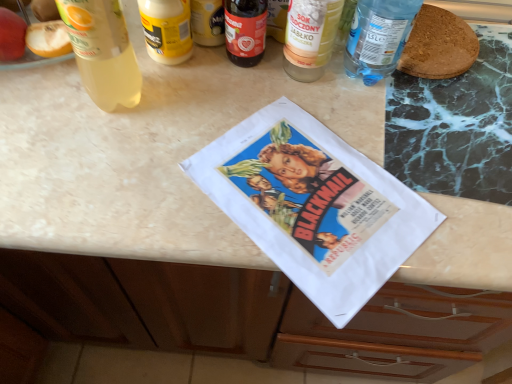
How much space does translucent plastic bottle at upper left, which is counted as the fifth bottle, starting from the right, occupy horizontally?

It is 4.09 inches.

Find the location of a particular element. transparent plastic bottle at upper right, the 1th bottle in the right-to-left sequence is located at coordinates (378, 37).

Between translucent glass bottle at upper center, positioned as the 4th bottle in left-to-right order, and dark red glass bottle at center, arranged as the third bottle when viewed from the right, which one has smaller size?

dark red glass bottle at center, arranged as the third bottle when viewed from the right.

Is dark red glass bottle at center, the third bottle from the left, surrounded by translucent glass bottle at upper center, positioned as the 4th bottle in left-to-right order?

No.

Considering the positions of point (306, 79) and point (225, 34), is point (306, 79) closer or farther from the camera than point (225, 34)?

Point (306, 79).

From a real-world perspective, who is located lower, translucent glass bottle at upper center, which is counted as the 2th bottle, starting from the right, or dark red glass bottle at center, the third bottle from the left?

dark red glass bottle at center, the third bottle from the left.

Is the depth of translucent glass bottle at upper center, which is counted as the 2th bottle, starting from the right, greater than that of yellow matte jar at upper center, marked as the second bottle in a left-to-right arrangement?

No, translucent glass bottle at upper center, which is counted as the 2th bottle, starting from the right, is closer to the camera.

From a real-world perspective, does translucent glass bottle at upper center, which is counted as the 2th bottle, starting from the right, stand above yellow matte jar at upper center, the fourth bottle from the right?

Yes, from a real-world perspective, translucent glass bottle at upper center, which is counted as the 2th bottle, starting from the right, is over yellow matte jar at upper center, the fourth bottle from the right

Looking at their sizes, would you say translucent glass bottle at upper center, positioned as the 4th bottle in left-to-right order, is wider or thinner than yellow matte jar at upper center, the fourth bottle from the right?

In the image, translucent glass bottle at upper center, positioned as the 4th bottle in left-to-right order, appears to be more narrow than yellow matte jar at upper center, the fourth bottle from the right.

From a real-world perspective, is translucent plastic bottle at upper left, which is counted as the fifth bottle, starting from the right, beneath dark red glass bottle at center, arranged as the third bottle when viewed from the right?

No, from a real-world perspective, translucent plastic bottle at upper left, which is counted as the fifth bottle, starting from the right, is not under dark red glass bottle at center, arranged as the third bottle when viewed from the right.

Between point (108, 3) and point (248, 54), which one is positioned behind?

The point (248, 54) is behind.

Is translucent plastic bottle at upper left, marked as the 1th bottle in a left-to-right arrangement, facing away from dark red glass bottle at center, the third bottle from the left?

No, translucent plastic bottle at upper left, marked as the 1th bottle in a left-to-right arrangement,'s orientation is not away from dark red glass bottle at center, the third bottle from the left.

Would you say translucent plastic bottle at upper left, marked as the 1th bottle in a left-to-right arrangement, is inside or outside dark red glass bottle at center, the third bottle from the left?

translucent plastic bottle at upper left, marked as the 1th bottle in a left-to-right arrangement, is located beyond the bounds of dark red glass bottle at center, the third bottle from the left.

Which object is further away from the camera, translucent plastic bottle at upper left, marked as the 1th bottle in a left-to-right arrangement, or translucent glass bottle at upper center, positioned as the 4th bottle in left-to-right order?

translucent glass bottle at upper center, positioned as the 4th bottle in left-to-right order, is behind.

Does translucent plastic bottle at upper left, which is counted as the fifth bottle, starting from the right, appear on the left side of translucent glass bottle at upper center, which is counted as the 2th bottle, starting from the right?

Correct, you'll find translucent plastic bottle at upper left, which is counted as the fifth bottle, starting from the right, to the left of translucent glass bottle at upper center, which is counted as the 2th bottle, starting from the right.

Does translucent plastic bottle at upper left, which is counted as the fifth bottle, starting from the right, turn towards translucent glass bottle at upper center, positioned as the 4th bottle in left-to-right order?

No, translucent plastic bottle at upper left, which is counted as the fifth bottle, starting from the right, is not turned towards translucent glass bottle at upper center, positioned as the 4th bottle in left-to-right order.

Considering the relative sizes of translucent plastic bottle at upper left, which is counted as the fifth bottle, starting from the right, and translucent glass bottle at upper center, which is counted as the 2th bottle, starting from the right, in the image provided, is translucent plastic bottle at upper left, which is counted as the fifth bottle, starting from the right, bigger than translucent glass bottle at upper center, which is counted as the 2th bottle, starting from the right,?

Correct, translucent plastic bottle at upper left, which is counted as the fifth bottle, starting from the right, is larger in size than translucent glass bottle at upper center, which is counted as the 2th bottle, starting from the right.

Is yellow matte jar at upper center, marked as the second bottle in a left-to-right arrangement, not inside dark red glass bottle at center, arranged as the third bottle when viewed from the right?

Yes, yellow matte jar at upper center, marked as the second bottle in a left-to-right arrangement, is not within dark red glass bottle at center, arranged as the third bottle when viewed from the right.

Is yellow matte jar at upper center, the fourth bottle from the right, bigger than dark red glass bottle at center, arranged as the third bottle when viewed from the right?

Yes.

Does yellow matte jar at upper center, marked as the second bottle in a left-to-right arrangement, touch dark red glass bottle at center, arranged as the third bottle when viewed from the right?

Yes, yellow matte jar at upper center, marked as the second bottle in a left-to-right arrangement, is next to dark red glass bottle at center, arranged as the third bottle when viewed from the right.

Is yellow matte jar at upper center, marked as the second bottle in a left-to-right arrangement, positioned in front of transparent plastic bottle at upper right, the 5th bottle in the left-to-right sequence?

No, yellow matte jar at upper center, marked as the second bottle in a left-to-right arrangement, is further to the viewer.

Which is nearer, (176, 4) or (406, 18)?

Point (176, 4) is positioned closer to the camera compared to point (406, 18).

Does yellow matte jar at upper center, marked as the second bottle in a left-to-right arrangement, contain transparent plastic bottle at upper right, the 5th bottle in the left-to-right sequence?

No.

From the picture: Does yellow matte jar at upper center, the fourth bottle from the right, have a greater width compared to transparent plastic bottle at upper right, the 1th bottle in the right-to-left sequence?

In fact, yellow matte jar at upper center, the fourth bottle from the right, might be narrower than transparent plastic bottle at upper right, the 1th bottle in the right-to-left sequence.

Is translucent plastic bottle at upper left, marked as the 1th bottle in a left-to-right arrangement, not near yellow matte jar at upper center, the fourth bottle from the right?

No.

Can yellow matte jar at upper center, the fourth bottle from the right, be found inside translucent plastic bottle at upper left, marked as the 1th bottle in a left-to-right arrangement?

No.

From the image's perspective, is translucent plastic bottle at upper left, which is counted as the fifth bottle, starting from the right, located above yellow matte jar at upper center, marked as the second bottle in a left-to-right arrangement?

No, from the image's perspective, translucent plastic bottle at upper left, which is counted as the fifth bottle, starting from the right, is not over yellow matte jar at upper center, marked as the second bottle in a left-to-right arrangement.

From a real-world perspective, which object rests below the other?

yellow matte jar at upper center, the fourth bottle from the right, from a real-world perspective.

From the translucent glass bottle at upper center, which is counted as the 2th bottle, starting from the right, count 2nd bottles backward and point to it. Please provide its 2D coordinates.

[(245, 31)]

Starting from the yellow matte jar at upper center, marked as the second bottle in a left-to-right arrangement, which bottle is the 1st one in front? Please provide its 2D coordinates.

[(310, 37)]

Looking at the image, which one is located further to transparent plastic bottle at upper right, the 1th bottle in the right-to-left sequence, yellow matte jar at upper center, the fourth bottle from the right, or dark red glass bottle at center, the third bottle from the left?

yellow matte jar at upper center, the fourth bottle from the right.

When comparing their distances from dark red glass bottle at center, the third bottle from the left, does translucent glass bottle at upper center, which is counted as the 2th bottle, starting from the right, or yellow matte jar at upper center, marked as the second bottle in a left-to-right arrangement, seem closer?

Based on the image, translucent glass bottle at upper center, which is counted as the 2th bottle, starting from the right, appears to be nearer to dark red glass bottle at center, the third bottle from the left.

From the image, which object appears to be nearer to translucent plastic bottle at upper left, marked as the 1th bottle in a left-to-right arrangement, dark red glass bottle at center, the third bottle from the left, or transparent plastic bottle at upper right, the 1th bottle in the right-to-left sequence?

dark red glass bottle at center, the third bottle from the left.

Which object lies nearer to the anchor point translucent glass bottle at upper center, positioned as the 4th bottle in left-to-right order, yellow matte jar at upper center, marked as the second bottle in a left-to-right arrangement, or dark red glass bottle at center, arranged as the third bottle when viewed from the right?

dark red glass bottle at center, arranged as the third bottle when viewed from the right.

Considering their positions, is dark red glass bottle at center, arranged as the third bottle when viewed from the right, positioned closer to yellow matte jar at upper center, marked as the second bottle in a left-to-right arrangement, than transparent plastic bottle at upper right, the 1th bottle in the right-to-left sequence?

The object closer to yellow matte jar at upper center, marked as the second bottle in a left-to-right arrangement, is dark red glass bottle at center, arranged as the third bottle when viewed from the right.

Looking at the image, which one is located closer to translucent plastic bottle at upper left, which is counted as the fifth bottle, starting from the right, transparent plastic bottle at upper right, the 5th bottle in the left-to-right sequence, or yellow matte jar at upper center, the fourth bottle from the right?

yellow matte jar at upper center, the fourth bottle from the right.

Considering their positions, is yellow matte jar at upper center, marked as the second bottle in a left-to-right arrangement, positioned further to translucent plastic bottle at upper left, which is counted as the fifth bottle, starting from the right, than transparent plastic bottle at upper right, the 5th bottle in the left-to-right sequence?

Based on the image, transparent plastic bottle at upper right, the 5th bottle in the left-to-right sequence, appears to be further to translucent plastic bottle at upper left, which is counted as the fifth bottle, starting from the right.

Based on their spatial positions, is translucent glass bottle at upper center, positioned as the 4th bottle in left-to-right order, or translucent plastic bottle at upper left, marked as the 1th bottle in a left-to-right arrangement, further from transparent plastic bottle at upper right, the 5th bottle in the left-to-right sequence?

Based on the image, translucent plastic bottle at upper left, marked as the 1th bottle in a left-to-right arrangement, appears to be further to transparent plastic bottle at upper right, the 5th bottle in the left-to-right sequence.

The width and height of the screenshot is (512, 384). Identify the location of bottle situated between yellow matte jar at upper center, marked as the second bottle in a left-to-right arrangement, and translucent glass bottle at upper center, positioned as the 4th bottle in left-to-right order, from left to right. (245, 31).

Locate an element on the screen. bottle between dark red glass bottle at center, arranged as the third bottle when viewed from the right, and transparent plastic bottle at upper right, the 1th bottle in the right-to-left sequence, in the horizontal direction is located at coordinates (310, 37).